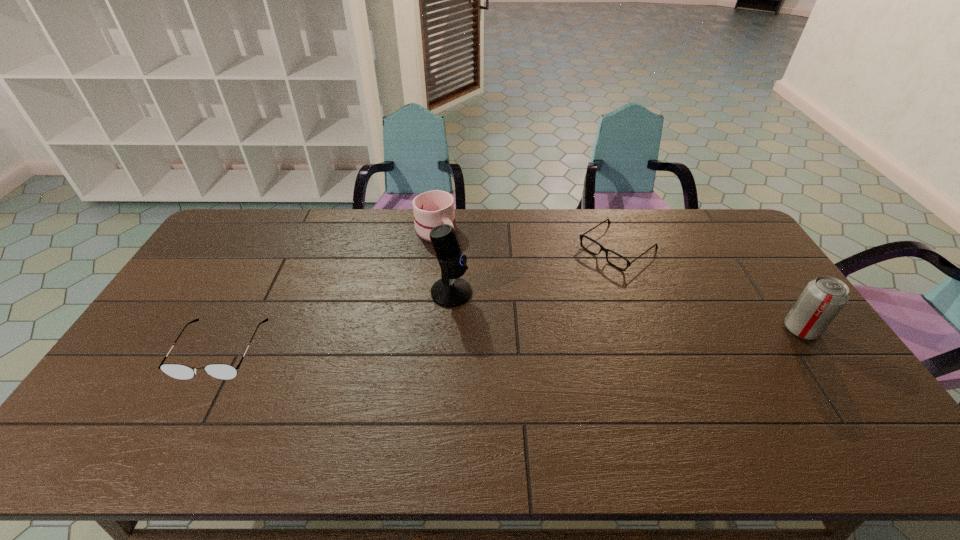
You are a GUI agent. You are given a task and a screenshot of the screen. Output one action in this format:
    pyautogui.click(x=<x>, y=<y>)
    Task: Click on the free space located on the back of the soda can
    
    Given the screenshot: What is the action you would take?
    pyautogui.click(x=770, y=285)

Locate an element on the screen. The width and height of the screenshot is (960, 540). free point located on the stand of the tallest object is located at coordinates (483, 306).

Locate an element on the screen. This screenshot has height=540, width=960. vacant space located on the stand of the tallest object is located at coordinates (545, 332).

You are a GUI agent. You are given a task and a screenshot of the screen. Output one action in this format:
    pyautogui.click(x=<x>, y=<y>)
    Task: Click on the free point located 0.210m on the stand of the tallest object
    This screenshot has width=960, height=540.
    Given the screenshot: What is the action you would take?
    pyautogui.click(x=530, y=326)

The width and height of the screenshot is (960, 540). I want to click on free region located 0.200m on the front-facing side of the shortest object, so (x=555, y=294).

Locate an element on the screen. vacant region located 0.260m on the front-facing side of the shortest object is located at coordinates (542, 303).

This screenshot has width=960, height=540. Identify the location of vacant space located on the front-facing side of the shortest object. (539, 306).

The width and height of the screenshot is (960, 540). Find the location of `free space located 0.160m on the side with the handle of the mug`. free space located 0.160m on the side with the handle of the mug is located at coordinates (466, 271).

Find the location of `vacant space located 0.200m on the side with the handle of the mug`. vacant space located 0.200m on the side with the handle of the mug is located at coordinates (471, 278).

Where is `vacant space located 0.090m on the side with the handle of the mug`? Image resolution: width=960 pixels, height=540 pixels. vacant space located 0.090m on the side with the handle of the mug is located at coordinates (456, 259).